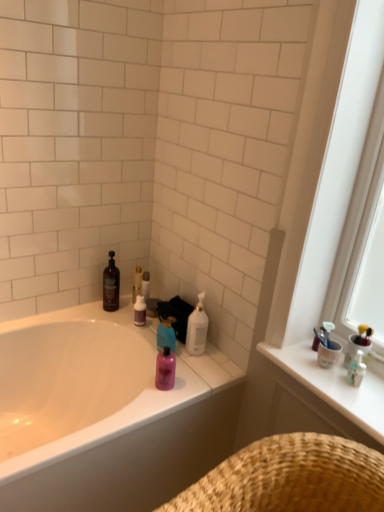
This screenshot has height=512, width=384. What are the coordinates of `free space in front of white glossy bottle at upper center, marked as the first cleaning product in a right-to-left arrangement` in the screenshot? It's located at (195, 370).